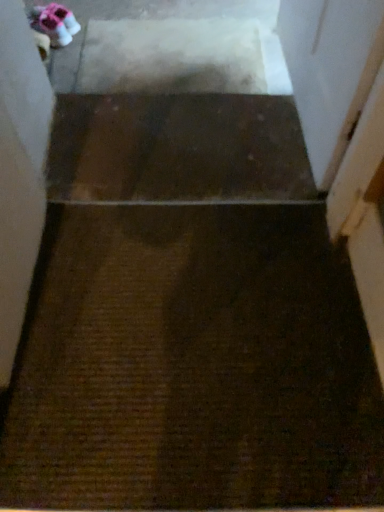
You are a GUI agent. You are given a task and a screenshot of the screen. Output one action in this format:
    pyautogui.click(x=<x>, y=<y>)
    Task: Click on the blank space situated above brown textured carpet at center (from a real-world perspective)
    
    Given the screenshot: What is the action you would take?
    pyautogui.click(x=188, y=138)